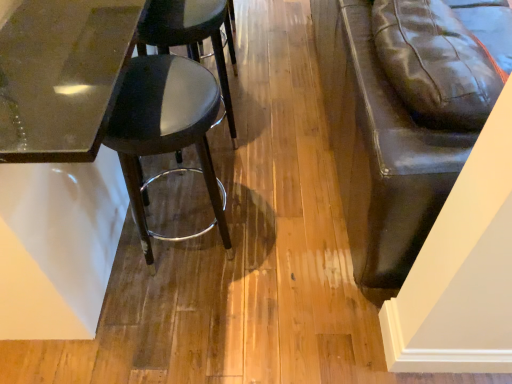
Question: In the image, is matte black stool at left, which is the first stool from bottom to top, on the left side or the right side of glossy glass table at upper left?

Choices:
 (A) right
 (B) left

Answer: (A)

Question: Considering the positions of matte black stool at left, which is the first stool from bottom to top, and glossy glass table at upper left in the image, is matte black stool at left, which is the first stool from bottom to top, taller or shorter than glossy glass table at upper left?

Choices:
 (A) tall
 (B) short

Answer: (B)

Question: Which is nearer to the matte black stool at left, which is the first stool from bottom to top?

Choices:
 (A) glossy glass table at upper left
 (B) black leather stool at center, positioned as the 1th stool in top-to-bottom order

Answer: (A)

Question: Considering the real-world distances, which object is farthest from the matte black stool at left, the 2th stool from the top?

Choices:
 (A) black leather stool at center, positioned as the 1th stool in top-to-bottom order
 (B) glossy glass table at upper left

Answer: (A)